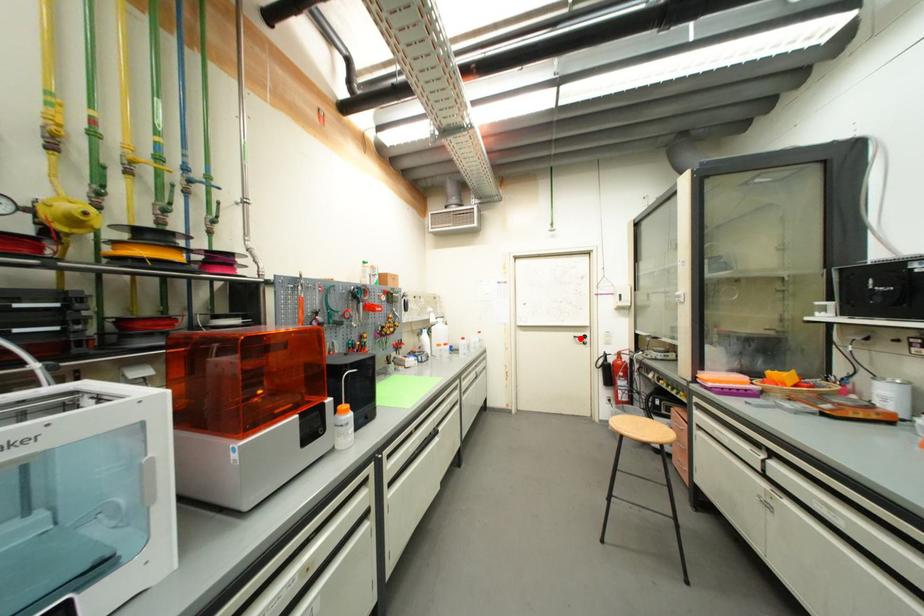
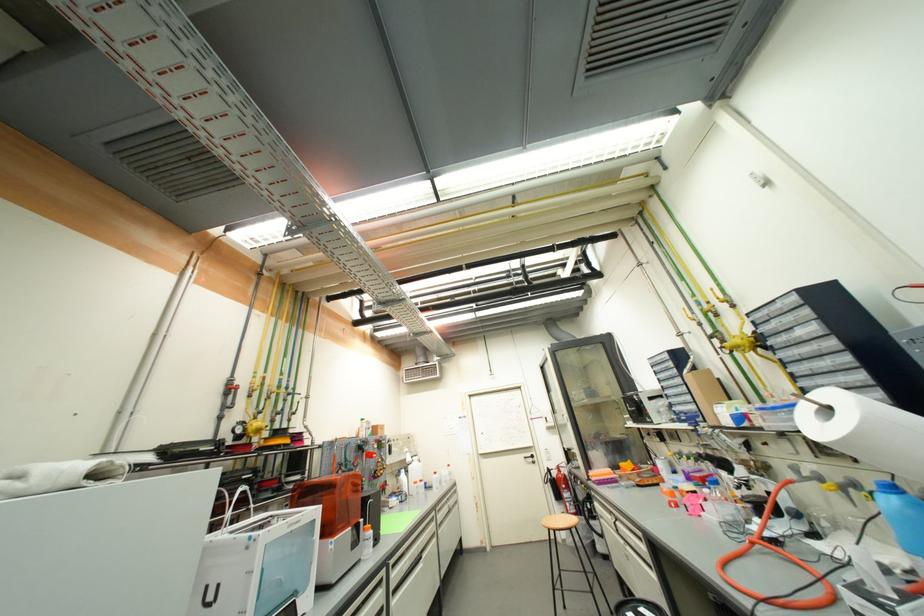
Find the pixel in the second image that matches the highlighted location in the first image.

(530, 459)